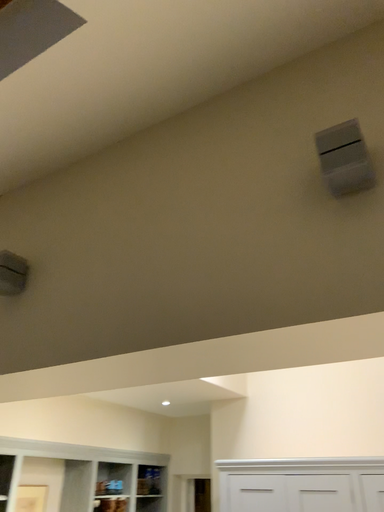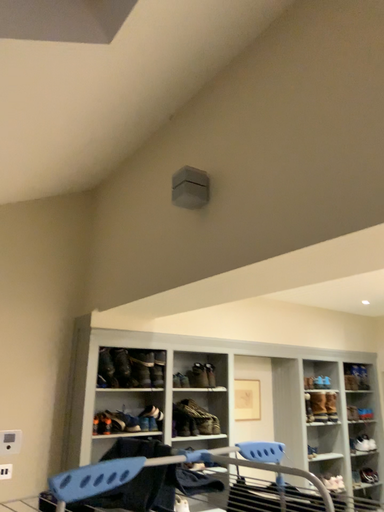
Question: How did the camera likely rotate when shooting the video?

Choices:
 (A) rotated left
 (B) rotated right

Answer: (A)